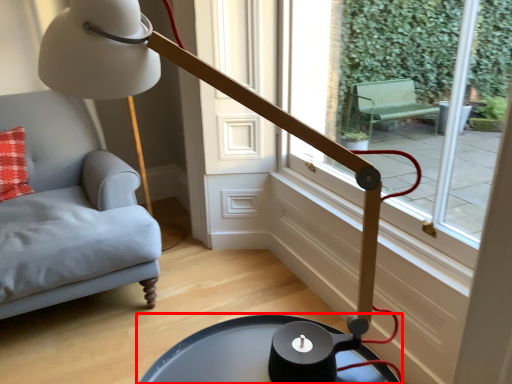
Question: From the image's perspective, where is table (annotated by the red box) located relative to window?

Choices:
 (A) above
 (B) below

Answer: (B)